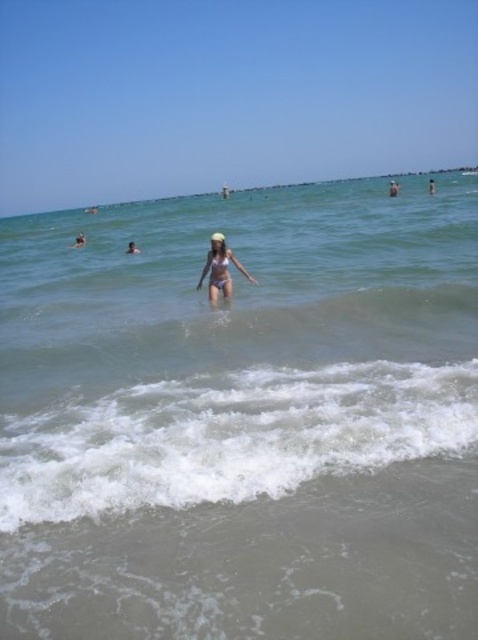
Question: Which is nearer to the pink matte swimsuit at center?

Choices:
 (A) clear water at center
 (B) smooth skin person at upper center

Answer: (A)

Question: From the image, what is the correct spatial relationship of pink matte swimsuit at center in relation to light brown skin at upper center?

Choices:
 (A) right
 (B) left

Answer: (B)

Question: Which of the following is the farthest from the observer?

Choices:
 (A) (99, 380)
 (B) (428, 188)
 (C) (215, 296)

Answer: (B)

Question: Is clear water at center bigger than white matte bikini at center?

Choices:
 (A) yes
 (B) no

Answer: (A)

Question: Considering the real-world distances, which object is farthest from the clear water at center?

Choices:
 (A) light brown skin at upper center
 (B) white bikini at center
 (C) smooth skin person at upper center

Answer: (C)

Question: Does white bikini at center have a smaller size compared to smooth skin person at upper center?

Choices:
 (A) yes
 (B) no

Answer: (A)